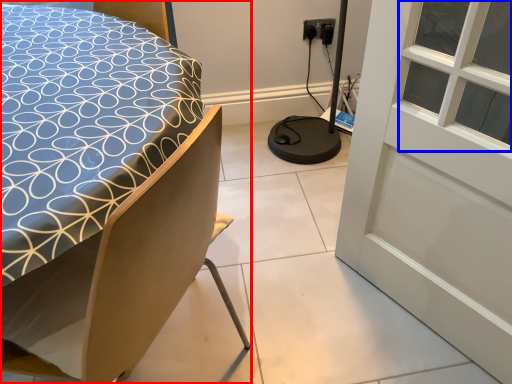
Question: Which object appears closest to the camera in this image, bed (highlighted by a red box) or window (highlighted by a blue box)?

Choices:
 (A) bed
 (B) window

Answer: (A)